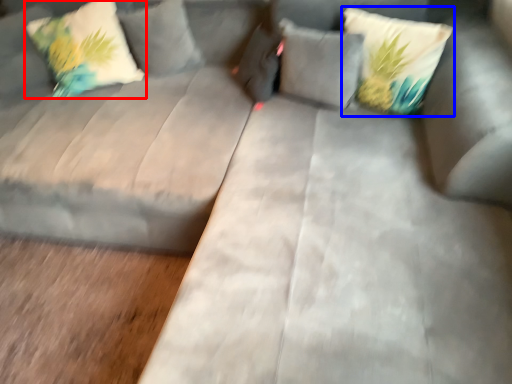
Question: Which object is further to the camera taking this photo, pillow (highlighted by a red box) or pillow (highlighted by a blue box)?

Choices:
 (A) pillow
 (B) pillow

Answer: (A)